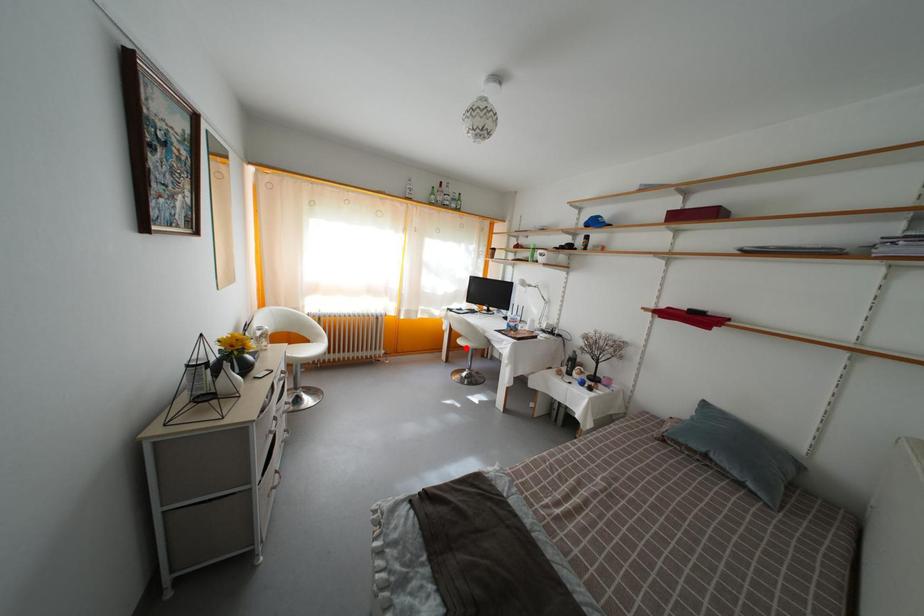
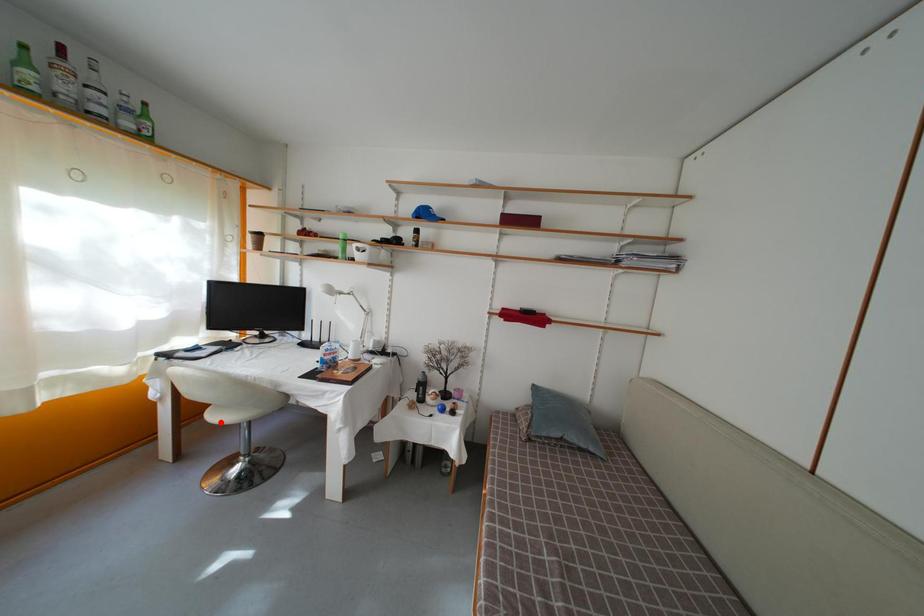
I am providing you with two images of the same scene from different viewpoints. A red point is marked on the first image and another point is marked on the second image. Is the red point in image1 aligned with the point shown in image2?

Yes